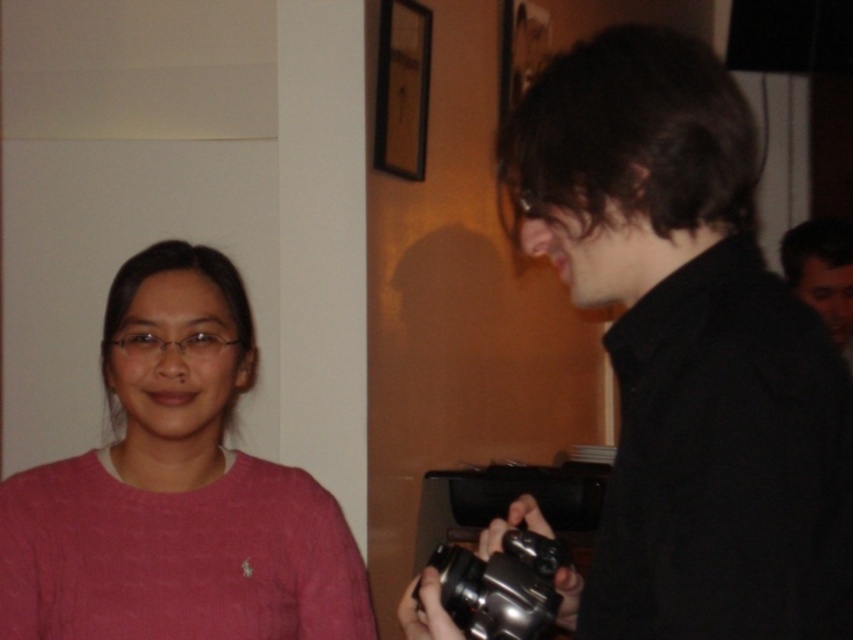
Which is behind, point (22, 628) or point (849, 269)?

The point (849, 269) is more distant.

Between point (61, 580) and point (839, 250), which one is positioned behind?

The point (839, 250) is behind.

Find the location of `pink sweater at left`. pink sweater at left is located at coordinates (177, 490).

Who is lower down, black matte camera at right or pink sweater at left?

pink sweater at left is lower down.

Which is in front, point (643, 278) or point (9, 500)?

Point (643, 278) is more forward.

Is point (653, 582) positioned before point (277, 588)?

That is True.

Locate an element on the screen. The image size is (853, 640). black matte camera at right is located at coordinates (686, 349).

Between point (550, 596) and point (827, 321), which one is positioned in front?

Point (550, 596)

Who is higher up, metallic silver camera at lower center or dark brown hair at right?

dark brown hair at right

Who is more distant from viewer, (473, 624) or (787, 237)?

Positioned behind is point (787, 237).

Find the location of `metallic silver camera at lower center`. metallic silver camera at lower center is located at coordinates (502, 586).